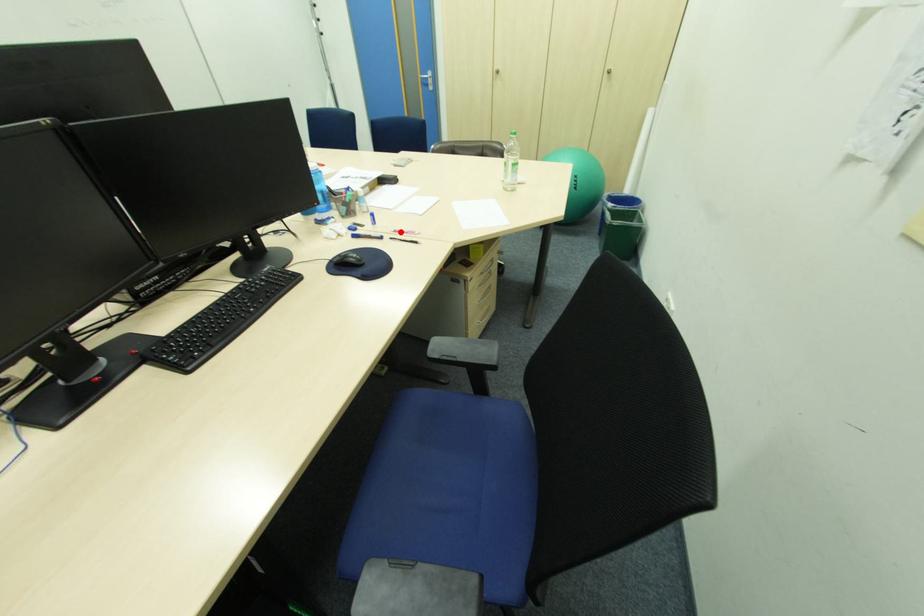
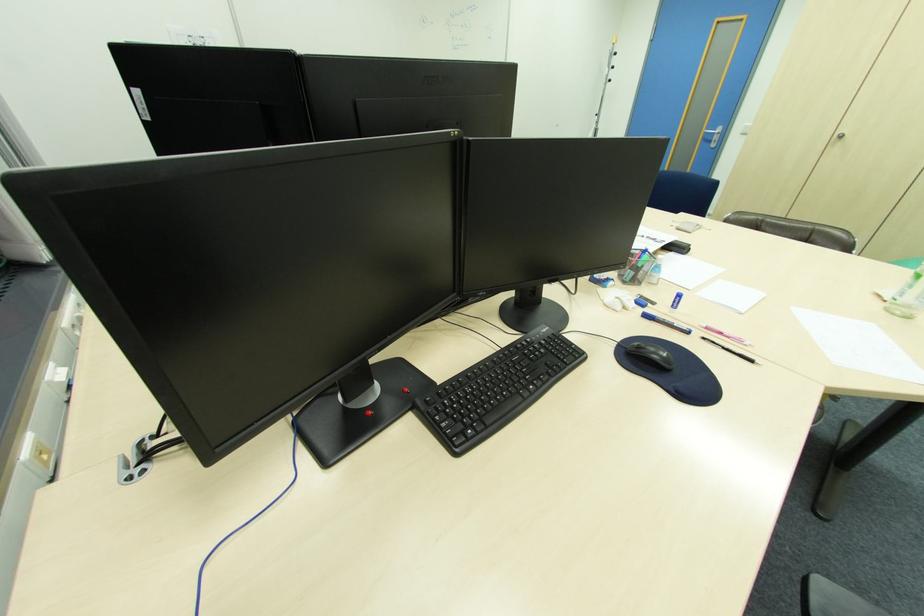
Locate, in the second image, the point that corresponds to the highlighted location in the first image.

(712, 328)